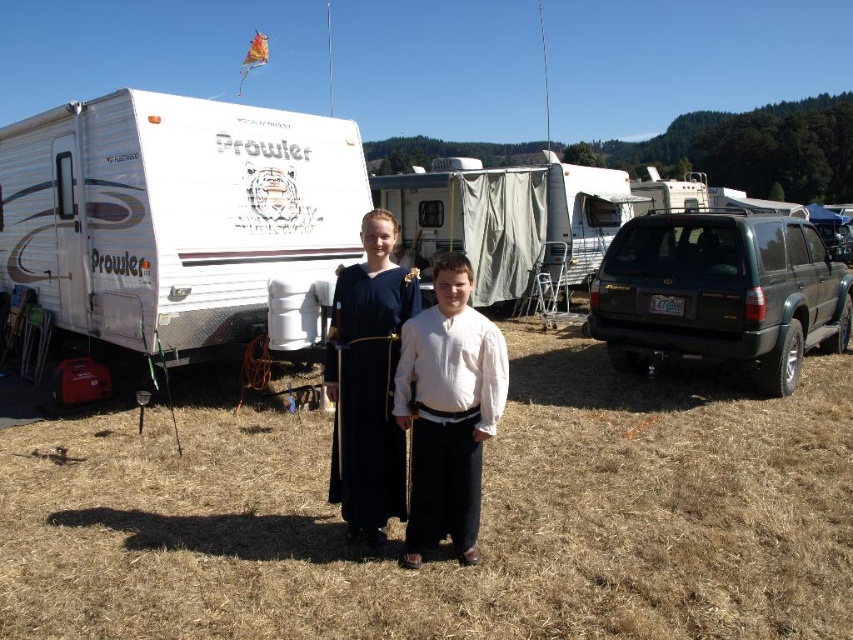
Is dark green plastic suv at right in front of dark blue fabric dress at center?

No, dark green plastic suv at right is behind dark blue fabric dress at center.

Is dark green plastic suv at right smaller than dark blue fabric dress at center?

Incorrect, dark green plastic suv at right is not smaller in size than dark blue fabric dress at center.

The height and width of the screenshot is (640, 853). Find the location of `dark green plastic suv at right`. dark green plastic suv at right is located at coordinates (720, 292).

Where is `dark green plastic suv at right`? This screenshot has width=853, height=640. dark green plastic suv at right is located at coordinates (720, 292).

This screenshot has height=640, width=853. I want to click on matte black dress at center, so click(x=448, y=412).

Is matte black dress at center taller than dark blue fabric dress at center?

In fact, matte black dress at center may be shorter than dark blue fabric dress at center.

Is point (416, 444) in front of point (376, 467)?

That is True.

The width and height of the screenshot is (853, 640). I want to click on matte black dress at center, so click(x=448, y=412).

Can you confirm if white glossy camper at left is thinner than dark green plastic suv at right?

Incorrect, white glossy camper at left's width is not less than dark green plastic suv at right's.

Which is in front, point (45, 246) or point (599, 321)?

Point (599, 321)

Where is `white glossy camper at left`? The width and height of the screenshot is (853, 640). white glossy camper at left is located at coordinates (173, 212).